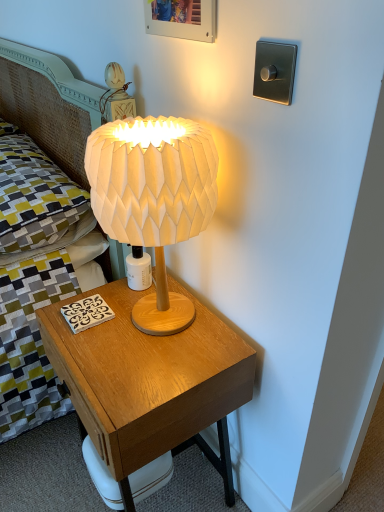
Question: Considering their positions, is wooden nightstand at center located in front of or behind yellow-green fabric pillow at upper left?

Choices:
 (A) behind
 (B) front

Answer: (B)

Question: Is wooden nightstand at center bigger or smaller than yellow-green fabric pillow at upper left?

Choices:
 (A) small
 (B) big

Answer: (B)

Question: Estimate the real-world distances between objects in this image. Which object is closer to the wooden nightstand at center?

Choices:
 (A) white paper lampshade at center
 (B) yellow-green fabric pillow at upper left
 (C) wooden picture frame at upper center

Answer: (A)

Question: Estimate the real-world distances between objects in this image. Which object is farther from the wooden picture frame at upper center?

Choices:
 (A) white paper lampshade at center
 (B) wooden nightstand at center
 (C) yellow-green fabric pillow at upper left

Answer: (B)